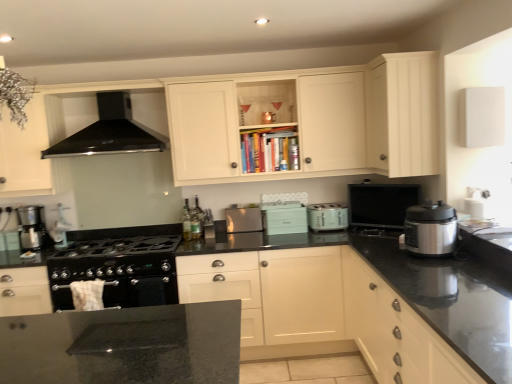
What are the coordinates of `free location above matte black monitor at upper right, which is counted as the second appliance, starting from the left (from a real-world perspective)` in the screenshot? It's located at (384, 188).